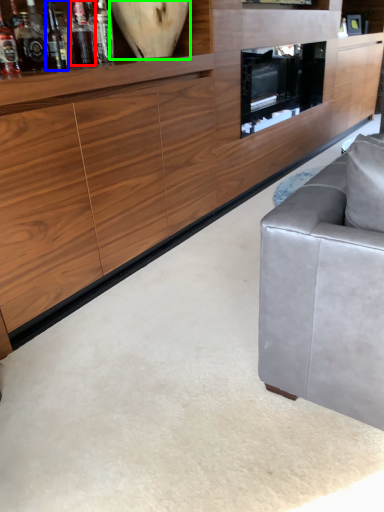
Question: Which is farther away from bottle (highlighted by a red box)? wine bottle (highlighted by a blue box) or vase (highlighted by a green box)?

Choices:
 (A) wine bottle
 (B) vase

Answer: (B)